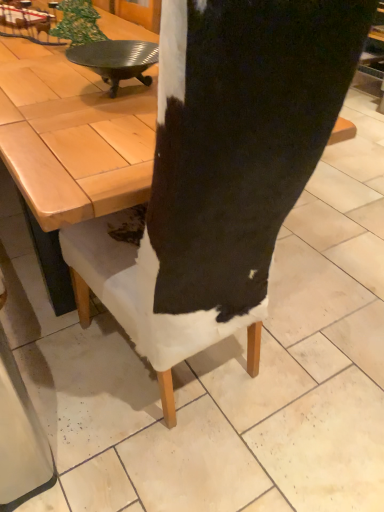
Identify the location of free space in front of metallic silver plate at upper left. Image resolution: width=384 pixels, height=512 pixels. (89, 123).